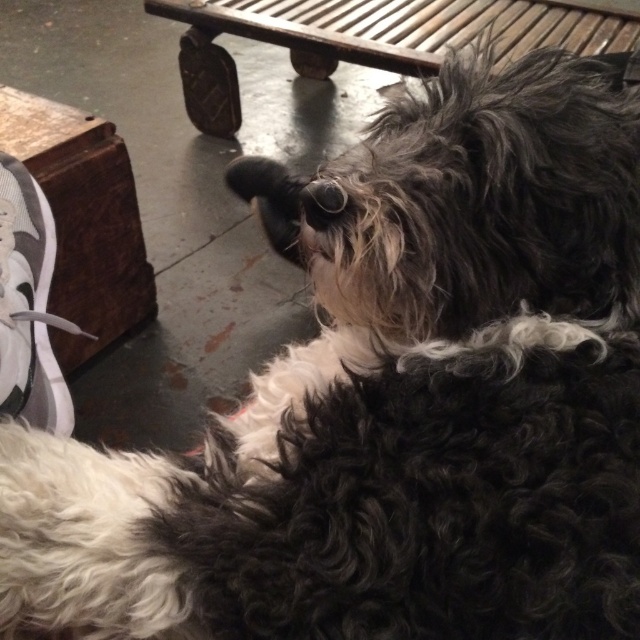
You are a photographer setting up a shot of the dog. You want to position the camera so that the wooden bench at upper center and the wooden park bench at left are both visible in the frame. Which bench should you place closer to the camera to ensure both are in view?

The wooden bench at upper center is located above the wooden park bench at left, so to ensure both are visible in the frame, you should place the wooden park bench at left closer to the camera.